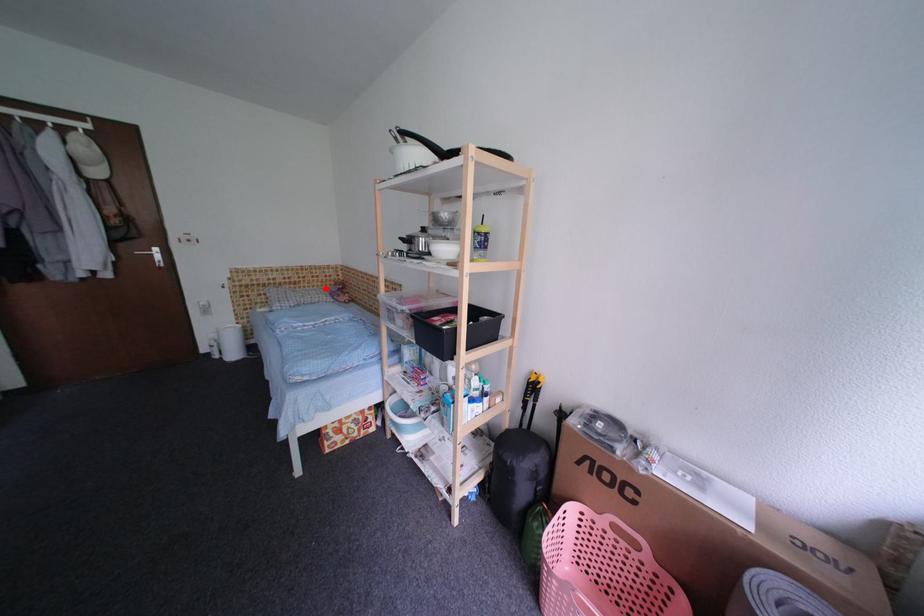
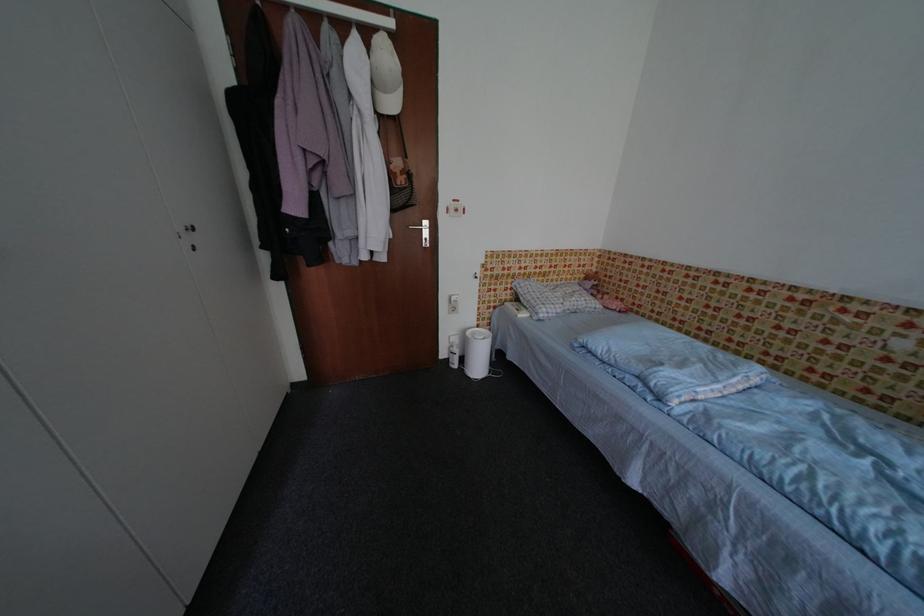
Locate, in the second image, the point that corresponds to the highlighted location in the first image.

(574, 282)